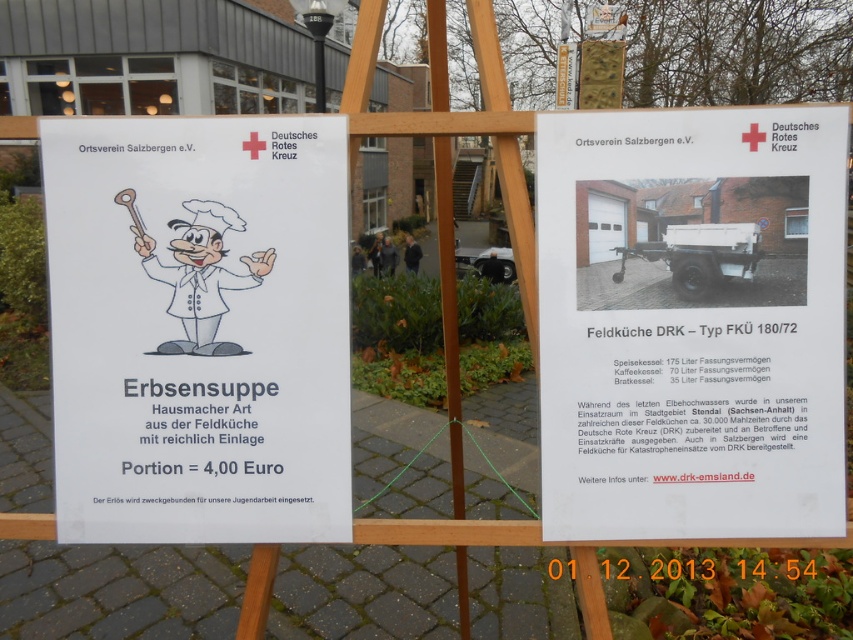
Between white paper poster at center and white paper at center, which one has more height?

white paper poster at center is taller.

Which is in front, point (225, 164) or point (779, 397)?

Point (779, 397)

Where is `white paper poster at center`? This screenshot has height=640, width=853. white paper poster at center is located at coordinates (198, 328).